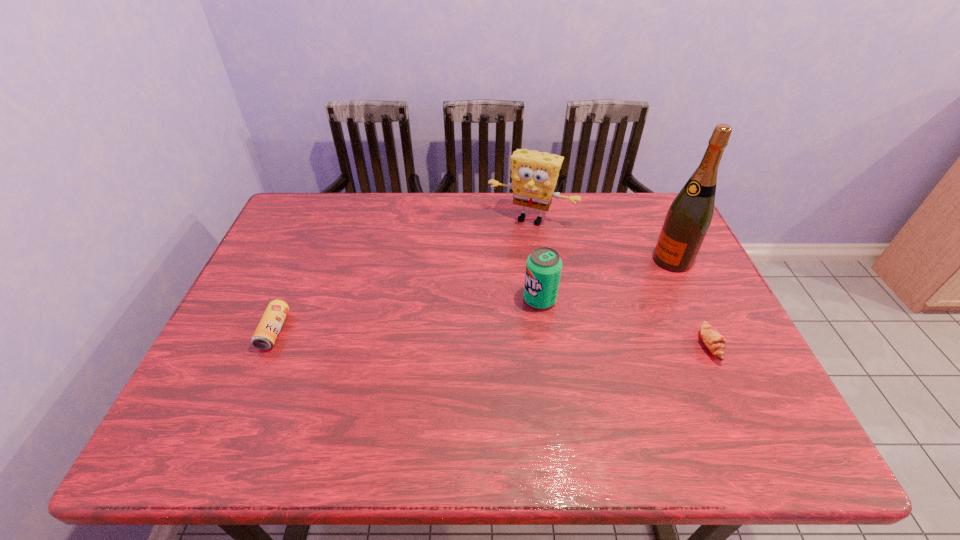
This screenshot has height=540, width=960. I want to click on vacant space that's between the sponge and the beer can, so click(402, 274).

Where is `free space between the shortest object and the tallest object`? The image size is (960, 540). free space between the shortest object and the tallest object is located at coordinates (691, 302).

The image size is (960, 540). What are the coordinates of `vacant space in between the sponge and the pastry` in the screenshot? It's located at (620, 282).

Find the location of a particular element. free area in between the second tallest object and the beer can is located at coordinates (402, 274).

The height and width of the screenshot is (540, 960). Identify the location of empty location between the third tallest object and the pastry. (625, 322).

Locate an element on the screen. The width and height of the screenshot is (960, 540). empty location between the pop soda and the leftmost object is located at coordinates (407, 315).

At what (x,y) coordinates should I click in order to perform the action: click on object that is the second closest to the tallest object. Please return your answer as a coordinate pair (x, y). Image resolution: width=960 pixels, height=540 pixels. Looking at the image, I should click on (534, 175).

This screenshot has height=540, width=960. Find the location of `object that is the second closest to the third shortest object`. object that is the second closest to the third shortest object is located at coordinates (688, 219).

Locate an element on the screen. The width and height of the screenshot is (960, 540). free space in the image that satisfies the following two spatial constraints: 1. on the front side of the farthest object; 2. on the front-facing side of the pastry is located at coordinates (548, 345).

Find the location of a particular element. vacant space that satisfies the following two spatial constraints: 1. on the back side of the pop soda; 2. on the left side of the tallest object is located at coordinates (535, 260).